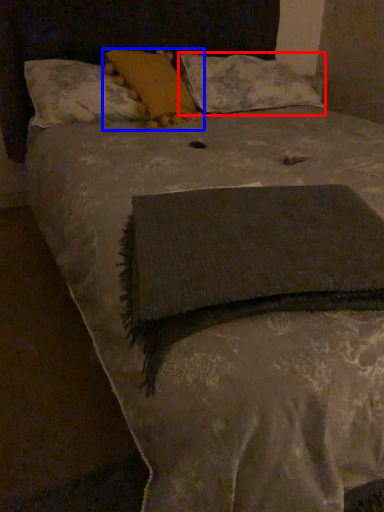
Question: Which object is closer to the camera taking this photo, pillow (highlighted by a red box) or pillow (highlighted by a blue box)?

Choices:
 (A) pillow
 (B) pillow

Answer: (B)